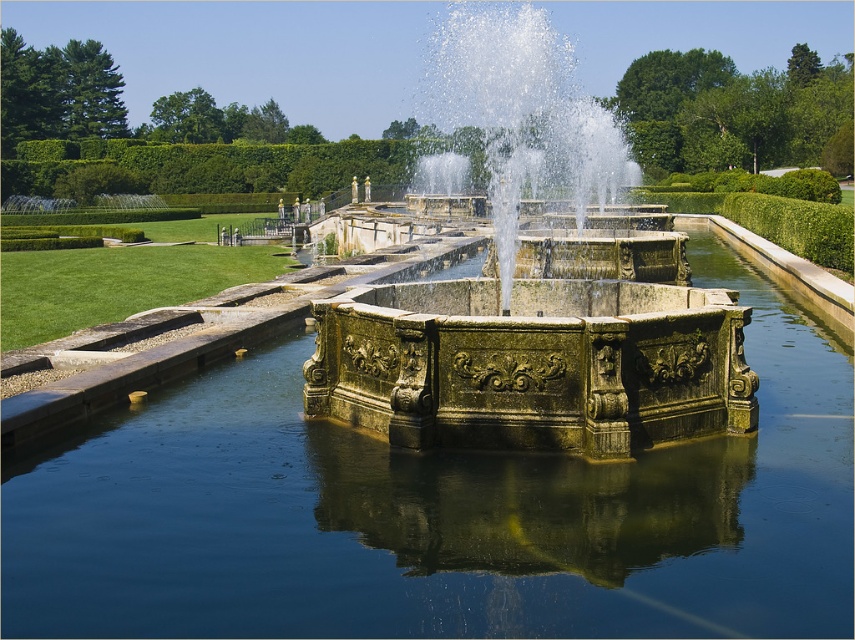
Question: Does greenish stone water at center have a smaller size compared to greenish stone fountain at center?

Choices:
 (A) yes
 (B) no

Answer: (A)

Question: Which point is farther to the camera?

Choices:
 (A) greenish stone water at center
 (B) greenish stone fountain at center

Answer: (B)

Question: Can you confirm if greenish stone water at center is wider than greenish stone fountain at center?

Choices:
 (A) no
 (B) yes

Answer: (A)

Question: Which object appears farthest from the camera in this image?

Choices:
 (A) greenish stone fountain at center
 (B) greenish stone water at center

Answer: (A)

Question: Observing the image, what is the correct spatial positioning of greenish stone water at center in reference to greenish stone fountain at center?

Choices:
 (A) left
 (B) right

Answer: (A)